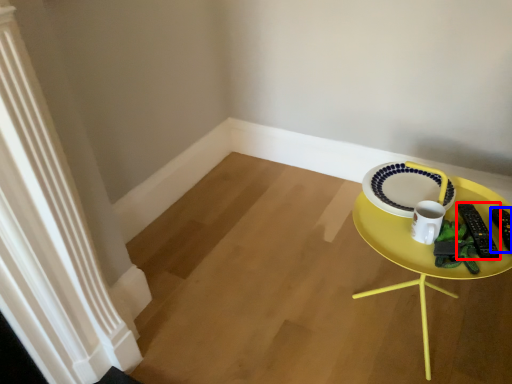
Question: Which object appears closest to the camera in this image, remote control (highlighted by a red box) or remote control (highlighted by a blue box)?

Choices:
 (A) remote control
 (B) remote control

Answer: (A)